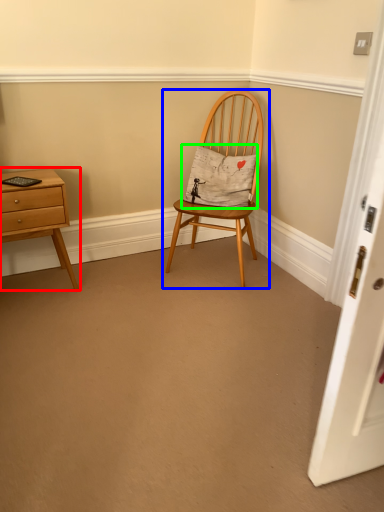
Question: Based on their relative distances, which object is farther from nightstand (highlighted by a red box)? Choose from chair (highlighted by a blue box) and pillow (highlighted by a green box).

Choices:
 (A) chair
 (B) pillow

Answer: (B)